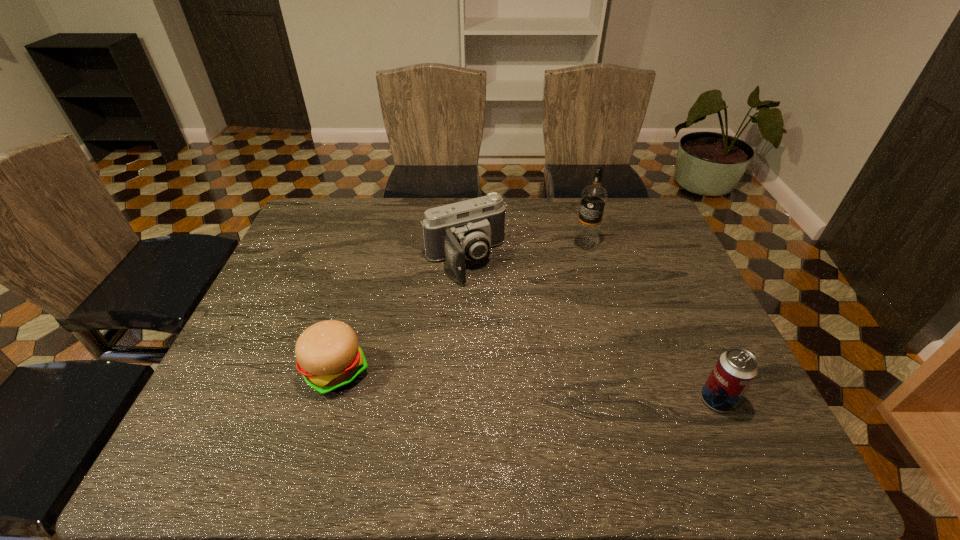
Image resolution: width=960 pixels, height=540 pixels. I want to click on blank region between the vodka and the shortest object, so click(x=461, y=307).

In order to click on free space between the beer can and the second object from left to right in this screenshot , I will do `click(591, 330)`.

Locate an element on the screen. This screenshot has height=540, width=960. vacant area that lies between the camera and the rightmost object is located at coordinates (591, 330).

Locate an element on the screen. The height and width of the screenshot is (540, 960). free space between the tallest object and the rightmost object is located at coordinates (651, 321).

You are a GUI agent. You are given a task and a screenshot of the screen. Output one action in this format:
    pyautogui.click(x=<x>, y=<y>)
    Task: Click on the vacant space in between the rightmost object and the leftmost object
    The image size is (960, 540).
    Given the screenshot: What is the action you would take?
    pyautogui.click(x=527, y=385)

This screenshot has height=540, width=960. Identify the location of free area in between the rightmost object and the camera. (591, 330).

What are the coordinates of `object that is the third closest to the tallest object` in the screenshot? It's located at (329, 357).

Identify the location of object that is the second closest one to the camera. The height and width of the screenshot is (540, 960). (329, 357).

Where is `vacant area that satisfies the following two spatial constraints: 1. on the back side of the tallest object; 2. on the left side of the camera`? The width and height of the screenshot is (960, 540). vacant area that satisfies the following two spatial constraints: 1. on the back side of the tallest object; 2. on the left side of the camera is located at coordinates (466, 243).

The height and width of the screenshot is (540, 960). I want to click on free spot that satisfies the following two spatial constraints: 1. on the front side of the leftmost object; 2. on the left side of the rightmost object, so click(328, 400).